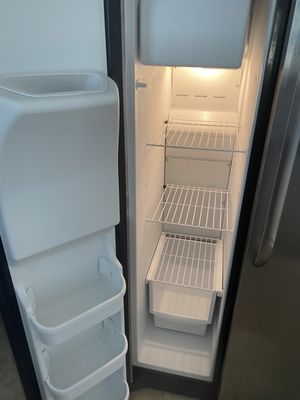
What are the coordinates of `fridge handle` in the screenshot? It's located at (287, 170).